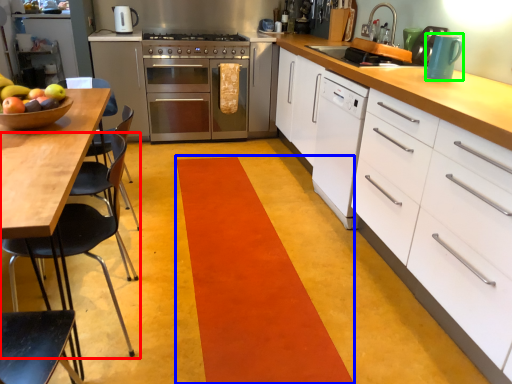
Question: Based on their relative distances, which object is nearer to chair (highlighted by a red box)? Choose from strip (highlighted by a blue box) and kitchen appliance (highlighted by a green box).

Choices:
 (A) strip
 (B) kitchen appliance

Answer: (A)